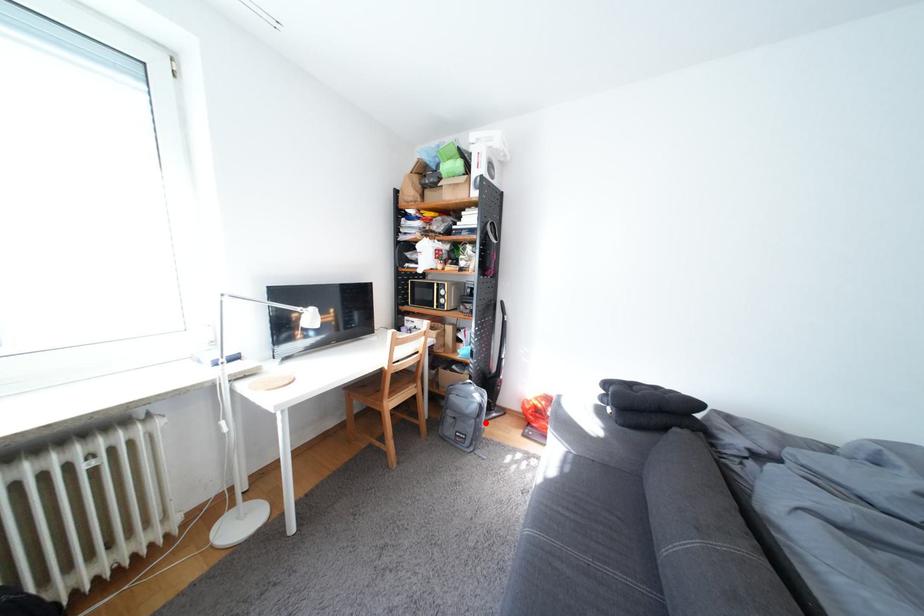
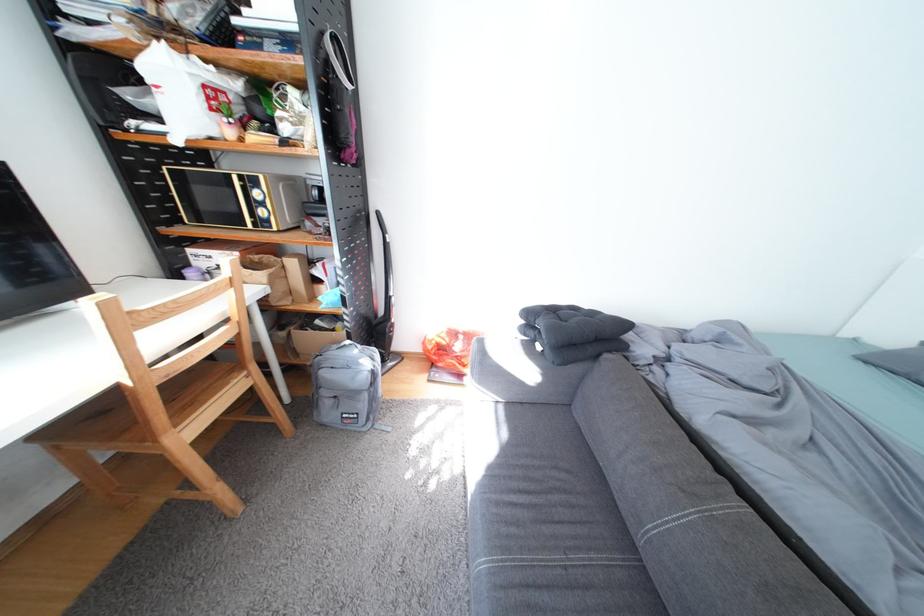
Question: A red point is marked in image1. In image2, is the corresponding 3D point closer to the camera or farther? Reply with the corresponding letter.

Choices:
 (A) The corresponding 3D point is closer.
 (B) The corresponding 3D point is farther.

Answer: (A)